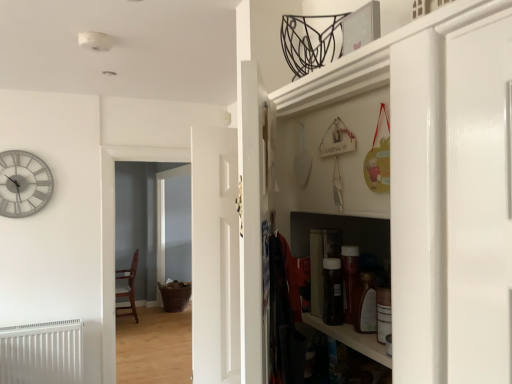
Question: Does white matte radiator at lower left have a lesser height compared to brown woven basket at center?

Choices:
 (A) yes
 (B) no

Answer: (A)

Question: Considering the relative sizes of white matte radiator at lower left and brown woven basket at center in the image provided, is white matte radiator at lower left bigger than brown woven basket at center?

Choices:
 (A) no
 (B) yes

Answer: (A)

Question: From a real-world perspective, does white matte radiator at lower left sit lower than brown woven basket at center?

Choices:
 (A) yes
 (B) no

Answer: (A)

Question: Would you say white matte radiator at lower left is outside brown woven basket at center?

Choices:
 (A) yes
 (B) no

Answer: (A)

Question: Is white matte radiator at lower left to the left of brown woven basket at center from the viewer's perspective?

Choices:
 (A) yes
 (B) no

Answer: (A)

Question: Visually, is white glossy cabinet at right positioned to the left or to the right of white matte radiator at lower left?

Choices:
 (A) left
 (B) right

Answer: (B)

Question: Is white glossy cabinet at right spatially inside white matte radiator at lower left, or outside of it?

Choices:
 (A) inside
 (B) outside

Answer: (B)

Question: From their relative heights in the image, would you say white glossy cabinet at right is taller or shorter than white matte radiator at lower left?

Choices:
 (A) tall
 (B) short

Answer: (A)

Question: From a real-world perspective, relative to white matte radiator at lower left, is white glossy cabinet at right vertically above or below?

Choices:
 (A) above
 (B) below

Answer: (A)

Question: Is white matte radiator at lower left inside or outside of white painted wood door at center, arranged as the first door when viewed from the back?

Choices:
 (A) inside
 (B) outside

Answer: (B)

Question: From a real-world perspective, is white matte radiator at lower left physically located above or below white painted wood door at center, arranged as the first door when viewed from the back?

Choices:
 (A) above
 (B) below

Answer: (B)

Question: In terms of width, does white matte radiator at lower left look wider or thinner when compared to white painted wood door at center, the 2th door viewed from the front?

Choices:
 (A) wide
 (B) thin

Answer: (A)

Question: Considering their positions, is white matte radiator at lower left located in front of or behind white painted wood door at center, the second door when ordered from right to left?

Choices:
 (A) behind
 (B) front

Answer: (B)

Question: Considering the positions of white glossy door at center, acting as the 2th door starting from the back, and wooden chair at left in the image, is white glossy door at center, acting as the 2th door starting from the back, taller or shorter than wooden chair at left?

Choices:
 (A) tall
 (B) short

Answer: (B)

Question: In terms of width, does white glossy door at center, which is the 2th door in left-to-right order, look wider or thinner when compared to wooden chair at left?

Choices:
 (A) wide
 (B) thin

Answer: (B)